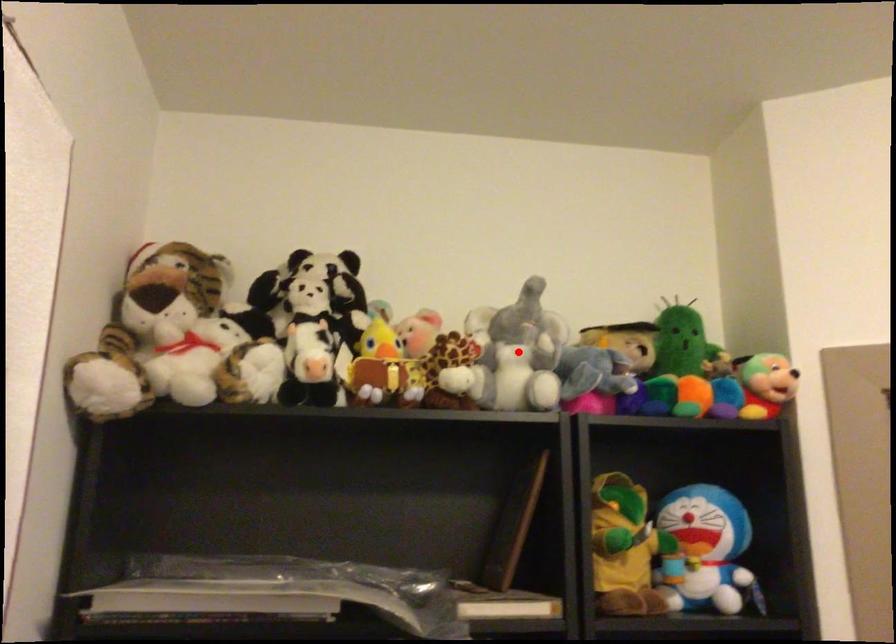
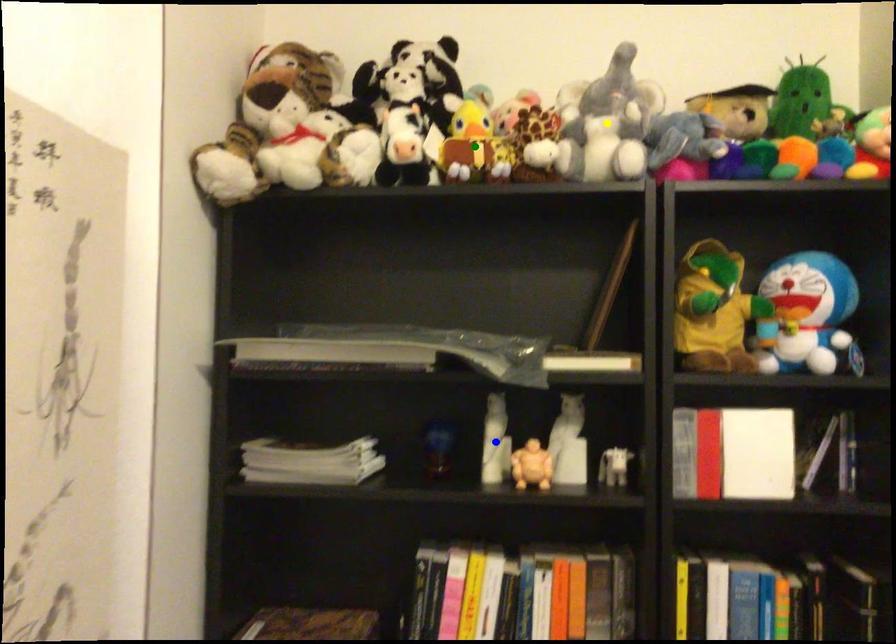
Question: I am providing you with two images of the same scene from different viewpoints. A red point is marked on the first image. You are given multiple points on the second image. In image 2, which mark is for the same physical point as the one in image 1?

Choices:
 (A) green point
 (B) yellow point
 (C) blue point

Answer: (B)